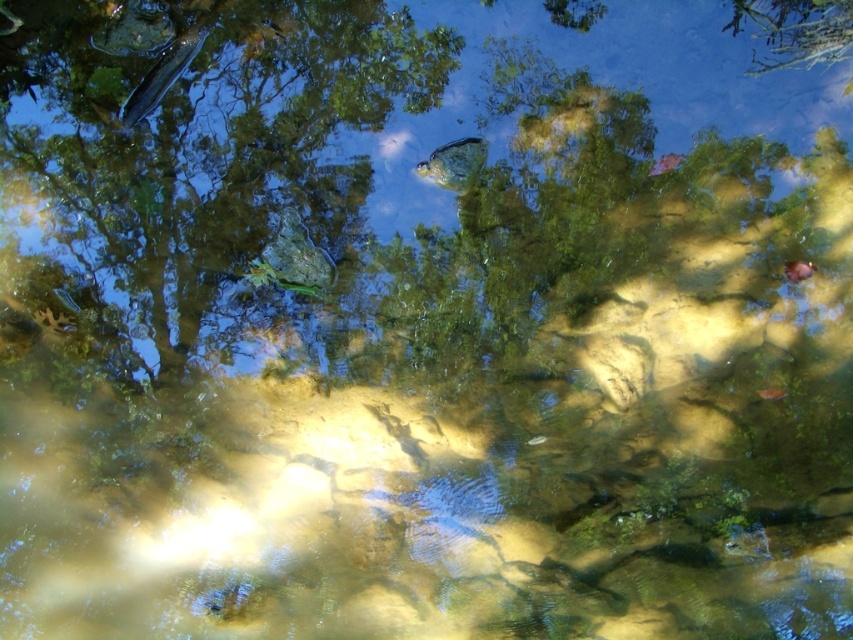
You are an underwater photographer aiming to capture both the shiny blue fish at upper left and the shiny orange fish at lower right in a single frame. Based on their positions, which fish would you need to adjust your camera angle upwards to include in the shot?

To include the shiny blue fish at upper left in the shot, you would need to adjust your camera angle upwards since it is positioned higher in the image compared to the shiny orange fish at lower right.

You are an angler who wants to catch both the shiny blue fish at upper left and the shiny orange fish at lower right. Which fish do you need to cast your fishing line closer to the water surface to catch?

The shiny blue fish at upper left is located above the shiny orange fish at lower right, so you should cast your fishing line closer to the water surface to catch the shiny blue fish at upper left.